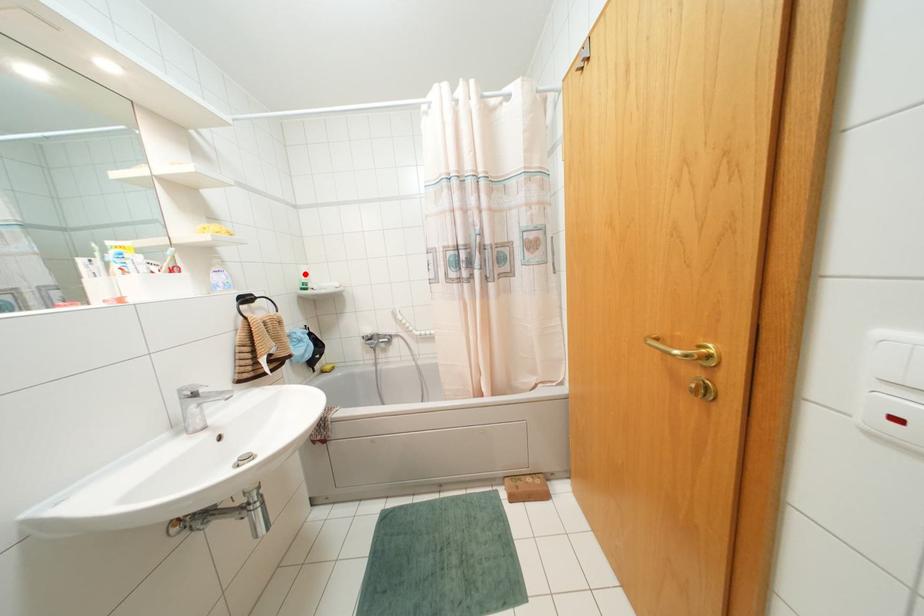
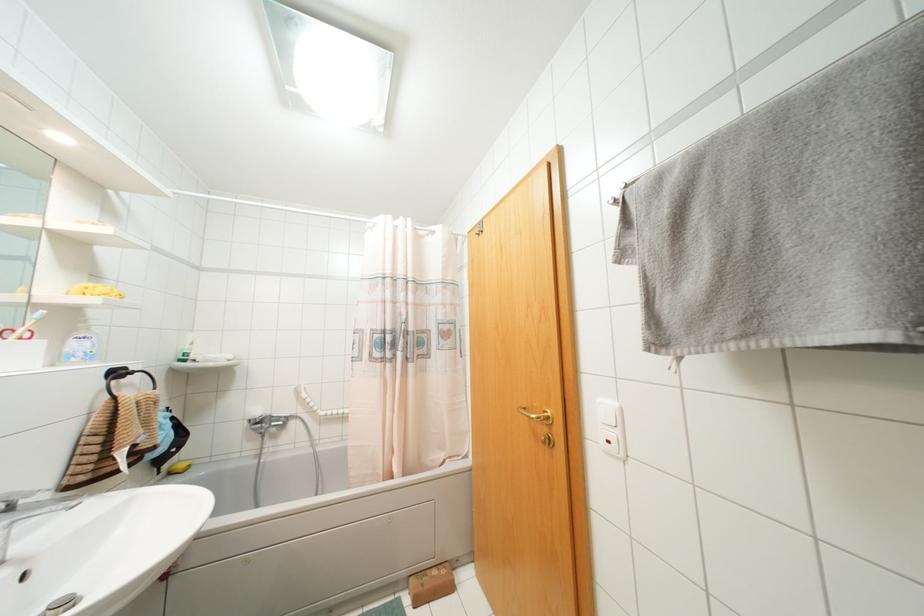
Where in the second image is the point corresponding to the highlighted location from the first image?

(190, 342)